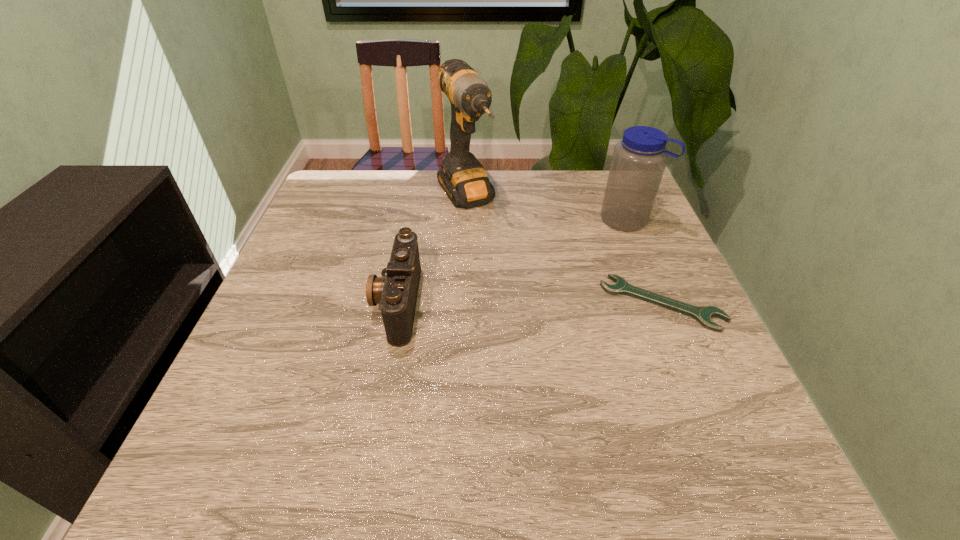
This screenshot has height=540, width=960. What are the coordinates of `object positioned at the far right corner` in the screenshot? It's located at (639, 160).

This screenshot has height=540, width=960. Identify the location of vacant space at the far edge of the desktop. (420, 184).

Where is `vacant space at the near edge`? This screenshot has height=540, width=960. vacant space at the near edge is located at coordinates (629, 408).

Locate an element on the screen. The height and width of the screenshot is (540, 960). free space at the right edge of the desktop is located at coordinates (660, 238).

In the image, there is a desktop. Identify the location of vacant space at the far left corner. (314, 199).

Image resolution: width=960 pixels, height=540 pixels. In the image, there is a desktop. In order to click on free region at the near left corner in this screenshot , I will do `click(299, 395)`.

In the image, there is a desktop. Where is `free space at the far right corner`? The image size is (960, 540). free space at the far right corner is located at coordinates (588, 200).

You are a GUI agent. You are given a task and a screenshot of the screen. Output one action in this format:
    pyautogui.click(x=<x>, y=<y>)
    Task: Click on the free point between the camera and the second tallest object
    Image resolution: width=960 pixels, height=540 pixels.
    Given the screenshot: What is the action you would take?
    pyautogui.click(x=512, y=261)

Where is `unoccupied position between the camera and the third object from right to left`? The height and width of the screenshot is (540, 960). unoccupied position between the camera and the third object from right to left is located at coordinates (431, 250).

Locate an element on the screen. The image size is (960, 540). empty location between the drill and the camera is located at coordinates (431, 250).